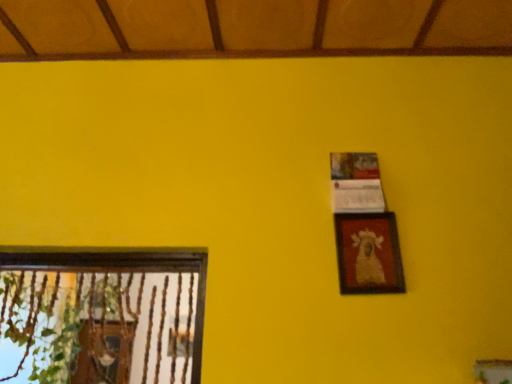
The width and height of the screenshot is (512, 384). Describe the element at coordinates (368, 254) in the screenshot. I see `matte gold picture frame at upper right` at that location.

Where is `matte gold picture frame at upper right`? This screenshot has height=384, width=512. matte gold picture frame at upper right is located at coordinates (368, 254).

This screenshot has height=384, width=512. Identify the location of matte gold picture frame at upper right. (368, 254).